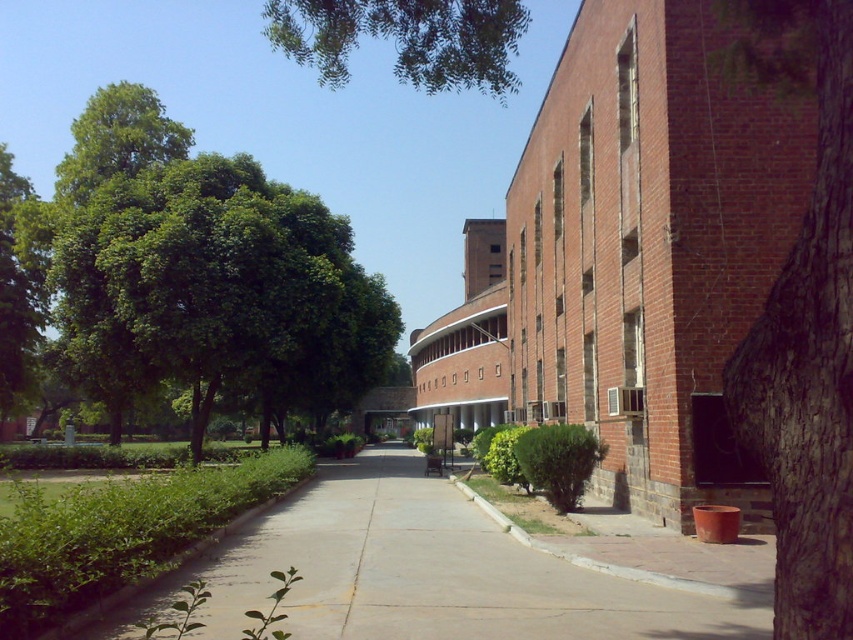
Question: Which is farther from the brown rough bark tree at right?

Choices:
 (A) green leafy tree at upper center
 (B) green leafy tree at left
 (C) smooth concrete pavement at center

Answer: (A)

Question: Which object is farther from the camera taking this photo?

Choices:
 (A) green leafy tree at left
 (B) green leafy tree at upper center
 (C) smooth concrete pavement at center
 (D) brown rough bark tree at right

Answer: (A)

Question: Can you confirm if smooth concrete pavement at center is wider than green leafy tree at upper center?

Choices:
 (A) no
 (B) yes

Answer: (A)

Question: Which point is farther to the camera?

Choices:
 (A) [311, 1]
 (B) [242, 166]
 (C) [785, 364]

Answer: (B)

Question: Where is smooth concrete pavement at center located in relation to green leafy tree at upper center in the image?

Choices:
 (A) below
 (B) above

Answer: (A)

Question: Where is brown rough bark tree at right located in relation to green leafy tree at upper center in the image?

Choices:
 (A) left
 (B) right

Answer: (B)